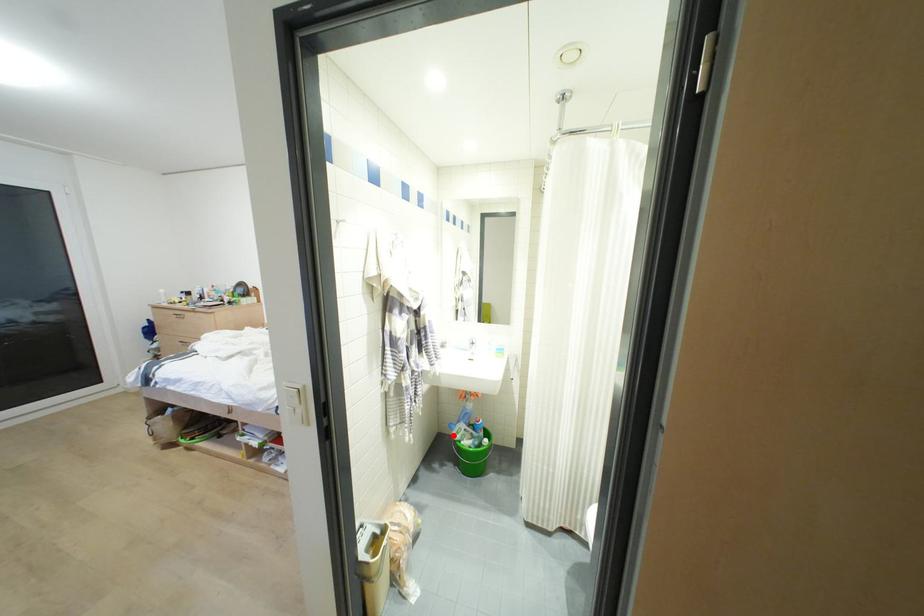
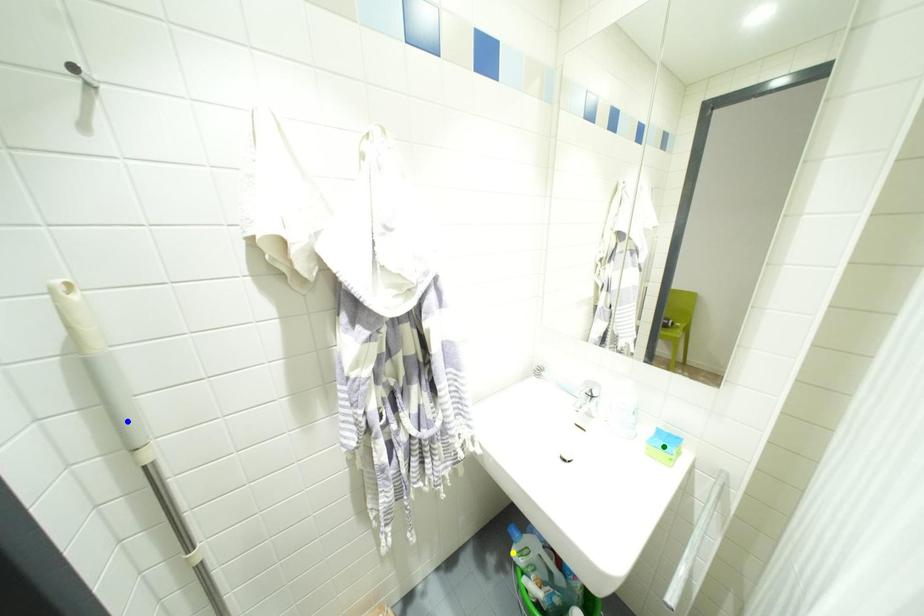
Question: I am providing you with two images of the same scene from different viewpoints. A red point is marked on the first image. You are given multiple points on the second image. Which mark in image 2 goes with the point in image 1?

Choices:
 (A) green point
 (B) yellow point
 (C) blue point

Answer: (B)